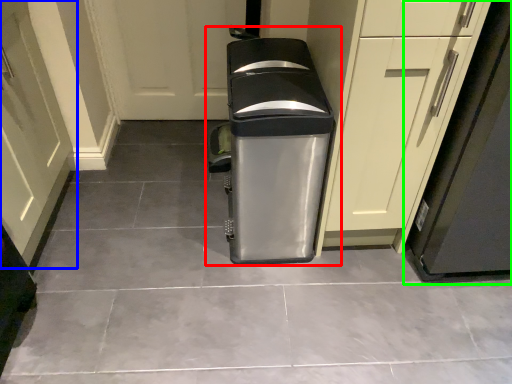
Question: Which object is positioned farthest from waste container (highlighted by a red box)? Select from door (highlighted by a blue box) and appliance (highlighted by a green box).

Choices:
 (A) door
 (B) appliance

Answer: (A)